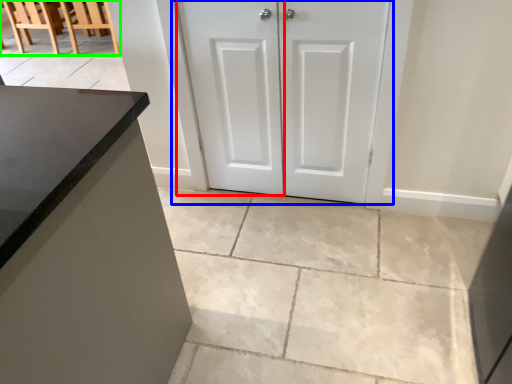
Question: Which object is positioned closest to screen door (highlighted by a red box)? Select from door (highlighted by a blue box) and chair (highlighted by a green box).

Choices:
 (A) door
 (B) chair

Answer: (A)